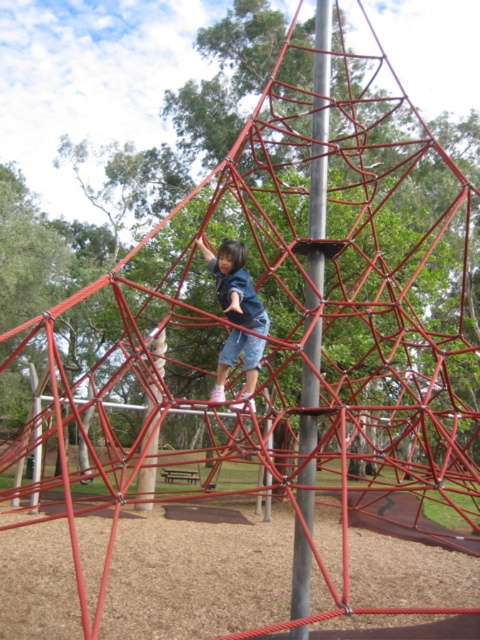
Question: Is metallic pole at center positioned behind matte blue shorts at center?

Choices:
 (A) no
 (B) yes

Answer: (A)

Question: Is metallic pole at center further to camera compared to matte blue shorts at center?

Choices:
 (A) no
 (B) yes

Answer: (A)

Question: Is metallic pole at center to the left of matte blue shorts at center from the viewer's perspective?

Choices:
 (A) yes
 (B) no

Answer: (B)

Question: Which of the following is the farthest from the observer?

Choices:
 (A) metallic pole at center
 (B) matte blue shorts at center

Answer: (B)